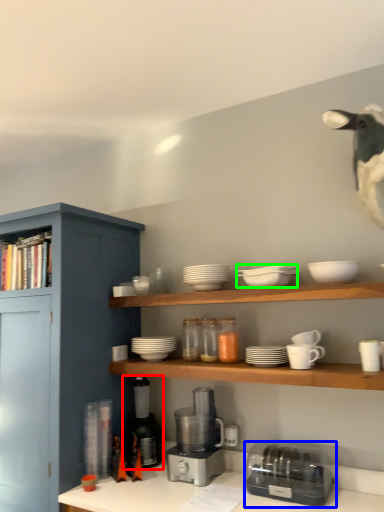
Question: Which object is the farthest from coffee machine (highlighted by a red box)? Choose among these: toaster (highlighted by a blue box) or tableware (highlighted by a green box).

Choices:
 (A) toaster
 (B) tableware

Answer: (B)